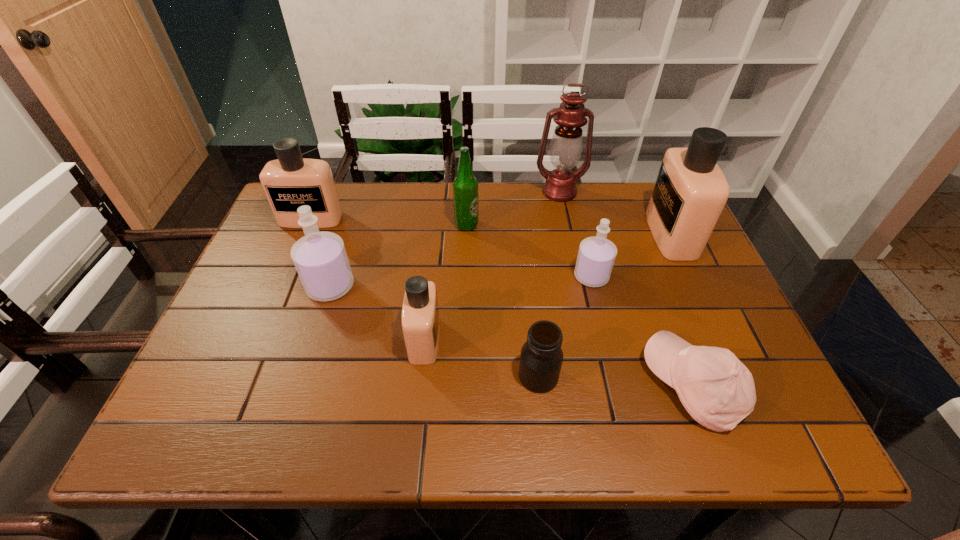
The height and width of the screenshot is (540, 960). What are the coordinates of `vacant space located 0.400m on the label of the green beer bottle` in the screenshot? It's located at (620, 225).

I want to click on vacant space located 0.100m on the right of the bigger purple perfume, so click(x=395, y=287).

This screenshot has width=960, height=540. I want to click on vacant area situated 0.360m on the front label of the leftmost beige perfume, so click(263, 332).

Where is `vacant space positioned 0.390m on the front label of the smallest beige perfume`? This screenshot has height=540, width=960. vacant space positioned 0.390m on the front label of the smallest beige perfume is located at coordinates (616, 340).

Locate an element on the screen. vacant region located on the back of the fourth perfume from left to right is located at coordinates (581, 234).

The width and height of the screenshot is (960, 540). Find the location of `blank space located on the left of the jar`. blank space located on the left of the jar is located at coordinates click(329, 376).

You are a GUI agent. You are given a task and a screenshot of the screen. Output one action in this format:
    pyautogui.click(x=<x>, y=<y>)
    Task: Click on the blank space located 0.160m on the front-facing side of the pink baseball cap
    The width and height of the screenshot is (960, 540).
    Given the screenshot: What is the action you would take?
    pyautogui.click(x=568, y=385)

Locate an element on the screen. free space located 0.140m on the front-facing side of the pink baseball cap is located at coordinates (578, 385).

The width and height of the screenshot is (960, 540). What are the coordinates of `vacant space situated 0.390m on the front-facing side of the pink baseball cap` in the screenshot? It's located at (455, 385).

Find the location of a particular element. oil lamp present at the far edge is located at coordinates (566, 145).